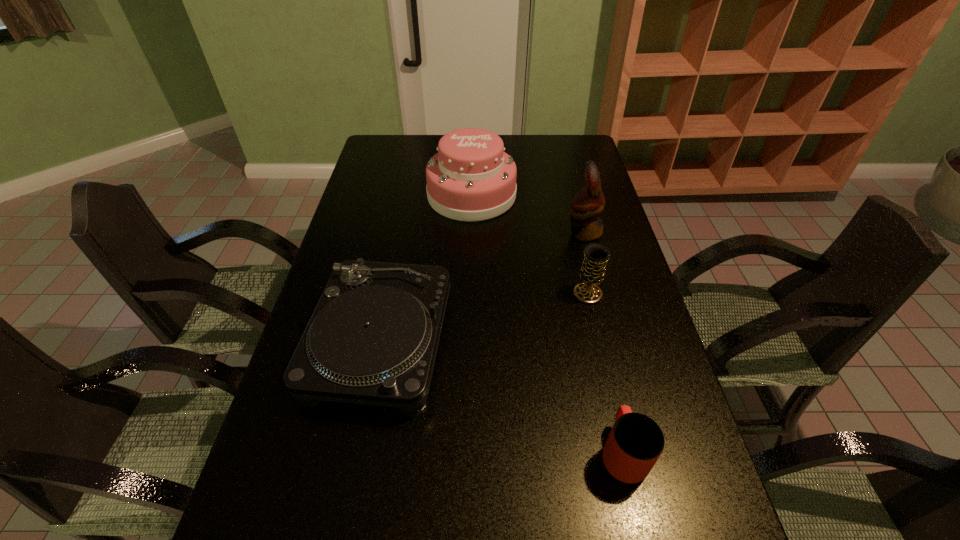
You are a GUI agent. You are given a task and a screenshot of the screen. Output one action in this format:
    pyautogui.click(x=<x>, y=<y>)
    Task: Click on the free space at the left edge
    
    Given the screenshot: What is the action you would take?
    pyautogui.click(x=404, y=171)

You are a GUI agent. You are given a task and a screenshot of the screen. Output one action in this format:
    pyautogui.click(x=<x>, y=<y>)
    Task: Click on the vacant point at the right edge
    The image size is (960, 540).
    Given the screenshot: What is the action you would take?
    pyautogui.click(x=675, y=449)

This screenshot has height=540, width=960. Identify the location of free space at the far right corner. (569, 150).

Locate an element on the screen. The width and height of the screenshot is (960, 540). unoccupied position between the record player and the second farthest object is located at coordinates (482, 287).

At what (x,y) coordinates should I click in order to perform the action: click on vacant space that's between the chalice and the farthest object. Please return your answer as a coordinate pair (x, y). The width and height of the screenshot is (960, 540). Looking at the image, I should click on (530, 244).

Where is `unoccupied area between the second tallest object and the fourth nearest object`? unoccupied area between the second tallest object and the fourth nearest object is located at coordinates (528, 214).

Identify the location of blank region between the cake and the chalice. The width and height of the screenshot is (960, 540). (530, 244).

Find the location of a particular element. The width and height of the screenshot is (960, 540). free area in between the record player and the chalice is located at coordinates (484, 318).

Locate an element on the screen. Image resolution: width=960 pixels, height=540 pixels. free space between the chalice and the fourth shortest object is located at coordinates (530, 244).

This screenshot has height=540, width=960. Identify the location of empty location between the nearest object and the record player. (501, 397).